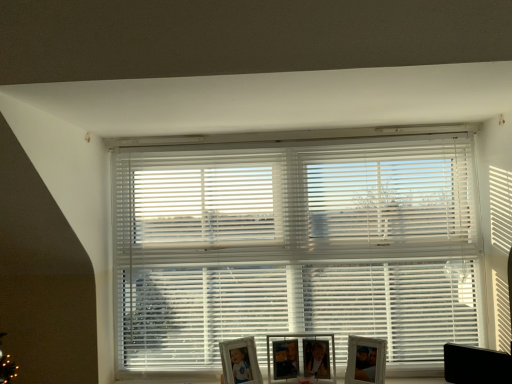
Question: From the image's perspective, is matte silver picture frame at lower center, which is the 1th picture frame from left to right, under white plastic blinds at center?

Choices:
 (A) yes
 (B) no

Answer: (A)

Question: From a real-world perspective, is matte silver picture frame at lower center, the 3th picture frame in the right-to-left sequence, beneath white plastic blinds at center?

Choices:
 (A) yes
 (B) no

Answer: (A)

Question: Does matte silver picture frame at lower center, the 3th picture frame in the right-to-left sequence, have a smaller size compared to white plastic blinds at center?

Choices:
 (A) no
 (B) yes

Answer: (B)

Question: From the image's perspective, is matte silver picture frame at lower center, which is the 1th picture frame from left to right, on white plastic blinds at center?

Choices:
 (A) no
 (B) yes

Answer: (A)

Question: Is matte silver picture frame at lower center, the 3th picture frame in the right-to-left sequence, far from white plastic blinds at center?

Choices:
 (A) no
 (B) yes

Answer: (A)

Question: Is point (239, 352) closer or farther from the camera than point (446, 380)?

Choices:
 (A) closer
 (B) farther

Answer: (A)

Question: In terms of width, does matte silver picture frame at lower center, which is the 1th picture frame from left to right, look wider or thinner when compared to black plastic swivel chair at lower right?

Choices:
 (A) wide
 (B) thin

Answer: (A)

Question: From their relative heights in the image, would you say matte silver picture frame at lower center, which is the 1th picture frame from left to right, is taller or shorter than black plastic swivel chair at lower right?

Choices:
 (A) short
 (B) tall

Answer: (B)

Question: Based on their sizes in the image, would you say matte silver picture frame at lower center, which is the 1th picture frame from left to right, is bigger or smaller than black plastic swivel chair at lower right?

Choices:
 (A) small
 (B) big

Answer: (B)

Question: Is point (225, 170) closer or farther from the camera than point (462, 379)?

Choices:
 (A) farther
 (B) closer

Answer: (A)

Question: From a real-world perspective, is white plastic blinds at center physically located above or below black plastic swivel chair at lower right?

Choices:
 (A) below
 (B) above

Answer: (B)

Question: Considering the positions of white plastic blinds at center and black plastic swivel chair at lower right in the image, is white plastic blinds at center taller or shorter than black plastic swivel chair at lower right?

Choices:
 (A) tall
 (B) short

Answer: (A)

Question: Considering their positions, is white plastic blinds at center located in front of or behind black plastic swivel chair at lower right?

Choices:
 (A) behind
 (B) front

Answer: (A)

Question: From their relative heights in the image, would you say white plastic blinds at center is taller or shorter than wooden photo frame at lower right, acting as the first picture frame starting from the right?

Choices:
 (A) short
 (B) tall

Answer: (B)

Question: Which is correct: white plastic blinds at center is inside wooden photo frame at lower right, acting as the first picture frame starting from the right, or outside of it?

Choices:
 (A) inside
 (B) outside

Answer: (B)